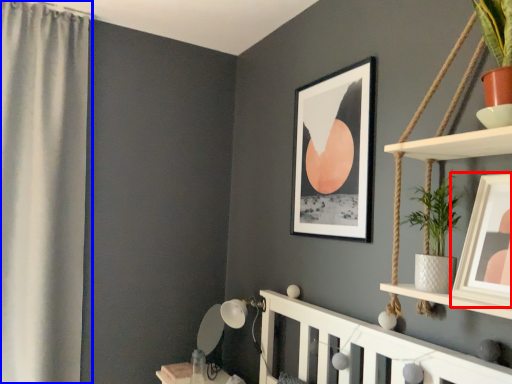
Question: Which of the following is the farthest to the observer, picture frame (highlighted by a red box) or curtain (highlighted by a blue box)?

Choices:
 (A) picture frame
 (B) curtain

Answer: (B)